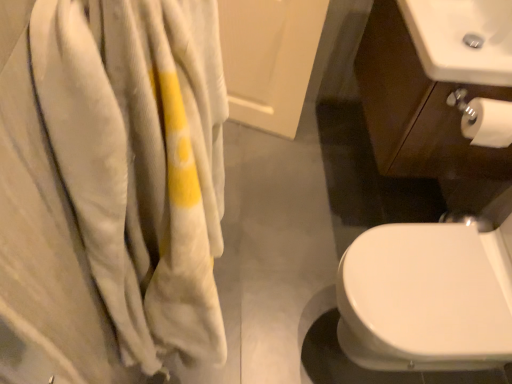
Question: Is white glossy sink at upper right, marked as the second sink in a front-to-back arrangement, smaller than white matte toilet paper at lower right?

Choices:
 (A) yes
 (B) no

Answer: (A)

Question: Is white glossy sink at upper right, marked as the second sink in a front-to-back arrangement, behind white matte toilet paper at lower right?

Choices:
 (A) yes
 (B) no

Answer: (B)

Question: Does white glossy sink at upper right, marked as the second sink in a front-to-back arrangement, have a lesser width compared to white matte toilet paper at lower right?

Choices:
 (A) no
 (B) yes

Answer: (A)

Question: From a real-world perspective, does white glossy sink at upper right, the first sink positioned from the back, stand above white matte toilet paper at lower right?

Choices:
 (A) no
 (B) yes

Answer: (B)

Question: From a real-world perspective, is white glossy sink at upper right, marked as the second sink in a front-to-back arrangement, beneath white matte toilet paper at lower right?

Choices:
 (A) no
 (B) yes

Answer: (A)

Question: From their relative heights in the image, would you say soft white towel at left is taller or shorter than white glossy sink at upper right, the first sink positioned from the back?

Choices:
 (A) short
 (B) tall

Answer: (B)

Question: Is soft white towel at left spatially inside white glossy sink at upper right, which is counted as the first sink, starting from the top, or outside of it?

Choices:
 (A) inside
 (B) outside

Answer: (B)

Question: In terms of size, does soft white towel at left appear bigger or smaller than white glossy sink at upper right, which is counted as the first sink, starting from the top?

Choices:
 (A) small
 (B) big

Answer: (B)

Question: From a real-world perspective, is soft white towel at left physically located above or below white glossy sink at upper right, which is counted as the second sink, starting from the bottom?

Choices:
 (A) above
 (B) below

Answer: (B)

Question: Is white glossy sink at upper right, the first sink positioned from the back, taller or shorter than soft white towel at left?

Choices:
 (A) tall
 (B) short

Answer: (B)

Question: Is white glossy sink at upper right, which is counted as the second sink, starting from the bottom, bigger or smaller than soft white towel at left?

Choices:
 (A) small
 (B) big

Answer: (A)

Question: Does point (458, 46) appear closer or farther from the camera than point (201, 82)?

Choices:
 (A) farther
 (B) closer

Answer: (A)

Question: Looking at their shapes, would you say white glossy sink at upper right, the first sink positioned from the back, is wider or thinner than soft white towel at left?

Choices:
 (A) thin
 (B) wide

Answer: (B)

Question: Is white matte toilet paper at lower right inside or outside of soft white towel at left?

Choices:
 (A) inside
 (B) outside

Answer: (B)

Question: From a real-world perspective, is white matte toilet paper at lower right positioned above or below soft white towel at left?

Choices:
 (A) below
 (B) above

Answer: (A)